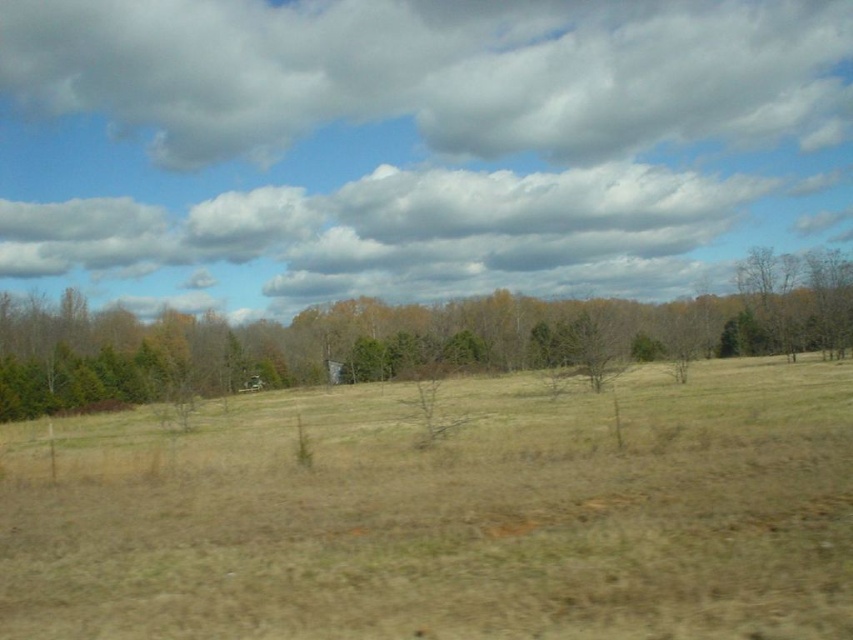
What do you see at coordinates (445, 513) in the screenshot? The image size is (853, 640). I see `brown dry grass at center` at bounding box center [445, 513].

Is the position of brown dry grass at center less distant than that of green textured tree at center?

Yes, it is.

Where is `brown dry grass at center`? The image size is (853, 640). brown dry grass at center is located at coordinates (445, 513).

Locate an element on the screen. The height and width of the screenshot is (640, 853). brown dry grass at center is located at coordinates (445, 513).

Between cloudy sky at upper center and transparent glass car window at center, which one appears on the left side from the viewer's perspective?

transparent glass car window at center

In the scene shown: Which is more to the right, cloudy sky at upper center or transparent glass car window at center?

cloudy sky at upper center is more to the right.

Does point (97, 104) come behind point (248, 381)?

Yes, it is.

Find the location of a particular element. cloudy sky at upper center is located at coordinates (437, 70).

Which of these two, cloudy sky at upper center or green textured tree at center, stands shorter?

Standing shorter between the two is green textured tree at center.

Which is in front, point (216, 140) or point (788, 275)?

Point (788, 275)

Identify the location of cloudy sky at upper center. The width and height of the screenshot is (853, 640). (437, 70).